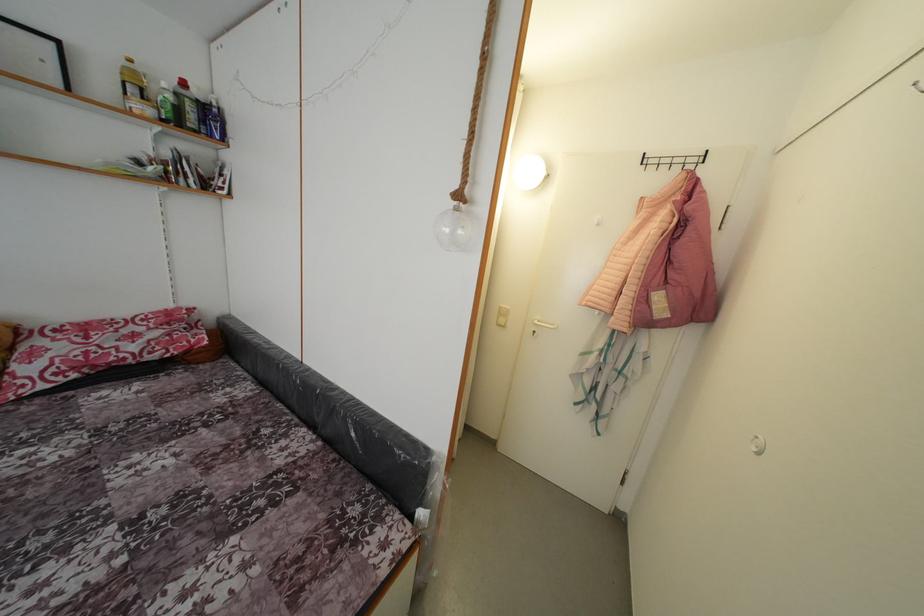
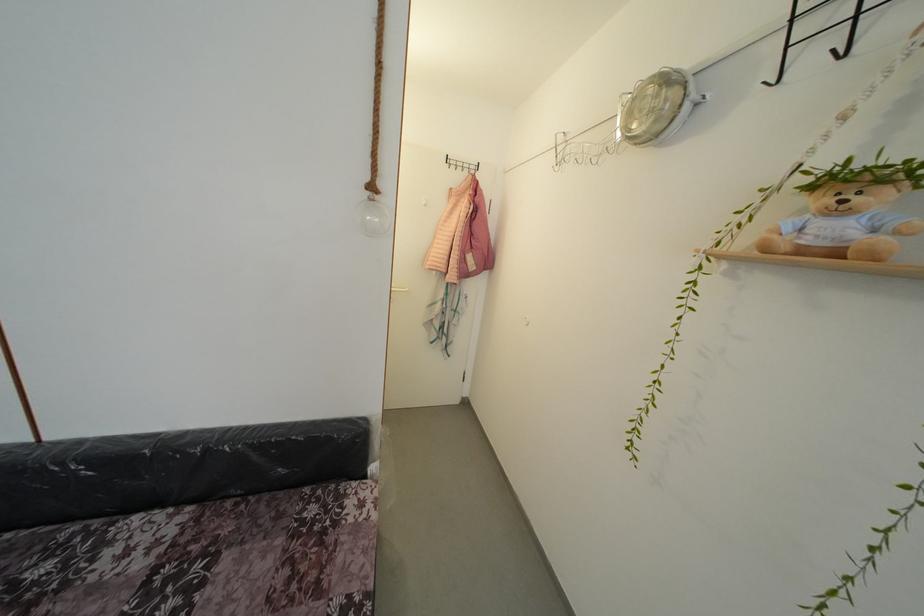
Find the pixel in the second image that matches (x=460, y=209) in the first image.

(373, 199)